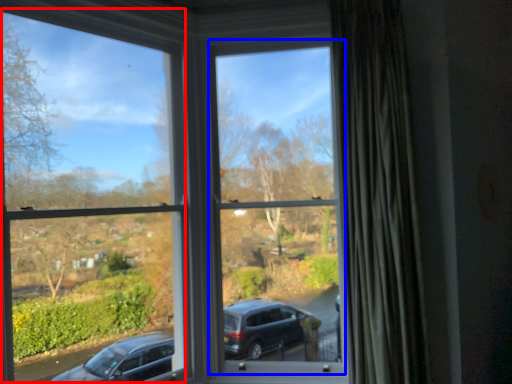
Question: Which object appears closest to the camera in this image, window frame (highlighted by a red box) or window frame (highlighted by a blue box)?

Choices:
 (A) window frame
 (B) window frame

Answer: (A)